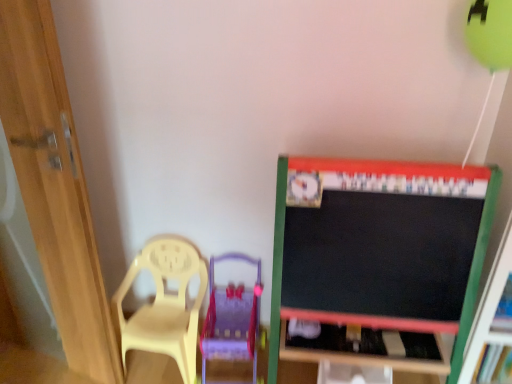
Identify the location of free point below wooden door at left (from a real-world perspective). (39, 364).